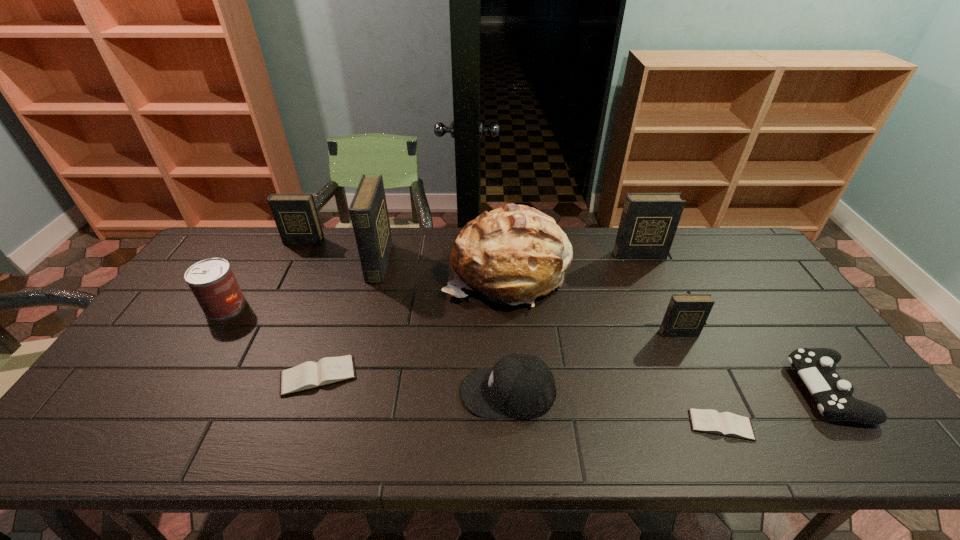
The width and height of the screenshot is (960, 540). What are the coordinates of `the biggest dark diary` in the screenshot? It's located at (368, 210).

Find the location of a particular element. the third dark diary from right to left is located at coordinates (368, 210).

Find the location of a particular element. The width and height of the screenshot is (960, 540). the third smallest dark diary is located at coordinates (649, 221).

Identify the location of bread. (513, 254).

Identify the location of the leftmost diary. This screenshot has width=960, height=540. (296, 217).

In order to click on the leftmost dark diary in this screenshot , I will do `click(296, 217)`.

Find the location of `can`. can is located at coordinates (212, 281).

This screenshot has height=540, width=960. I want to click on the smallest dark diary, so point(686,314).

Locate an element on the screen. the third shortest diary is located at coordinates (686, 314).

You are a GUI agent. You are given a task and a screenshot of the screen. Output one action in this format:
    pyautogui.click(x=<x>, y=<y>)
    Task: Click on the seventh tallest object
    
    Given the screenshot: What is the action you would take?
    pyautogui.click(x=521, y=386)